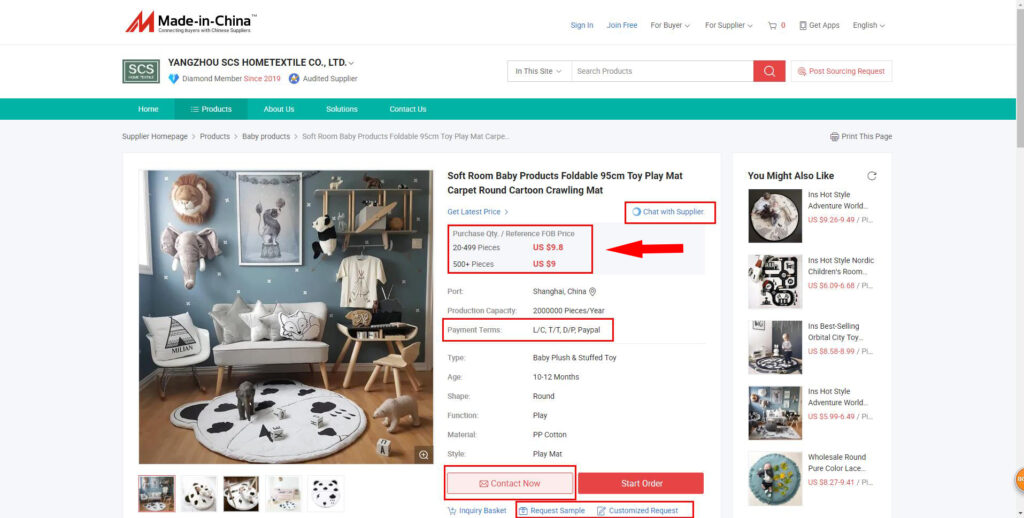
At what (x,y) coordinates should I click in order to perform the action: click on black and white stuffed bear. Please return your answer as a coordinate pair (x, y). Looking at the image, I should click on (329, 242).